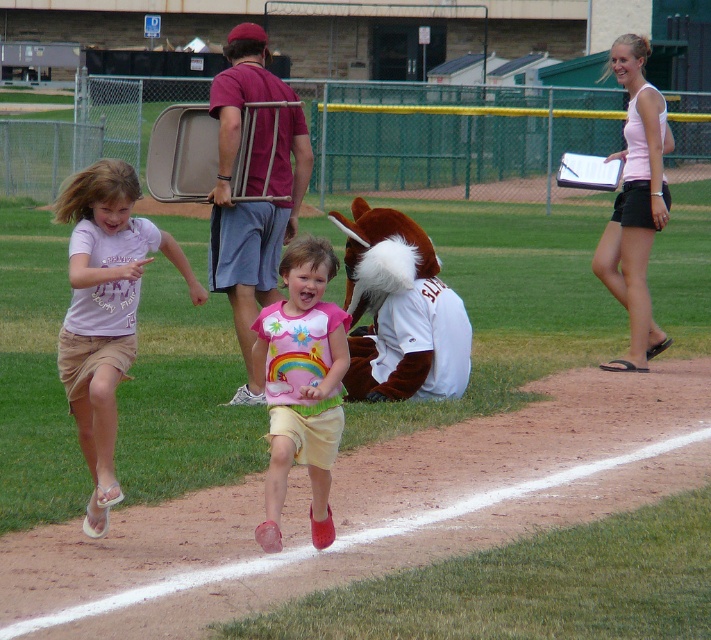
You are a photographer standing at the edge of the baseball field. You need to capture a photo that includes both the beige cotton shorts at lower left and the matte pink shirt at center. Based on their distance, will you need to zoom in or zoom out to include both in the frame?

The beige cotton shorts at lower left and matte pink shirt at center are 10.05 feet apart from each other. To include both in the frame, you would need to zoom out to capture the distance between them.